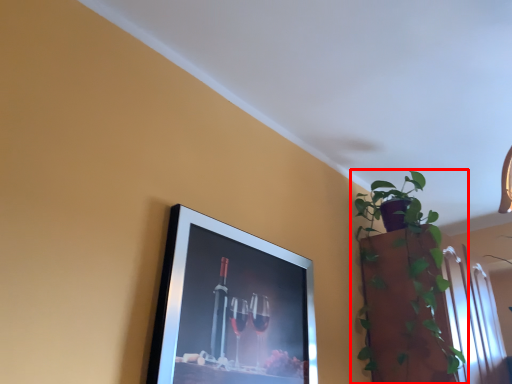
Question: Where is houseplant (annotated by the red box) located in relation to picture frame in the image?

Choices:
 (A) left
 (B) right

Answer: (B)